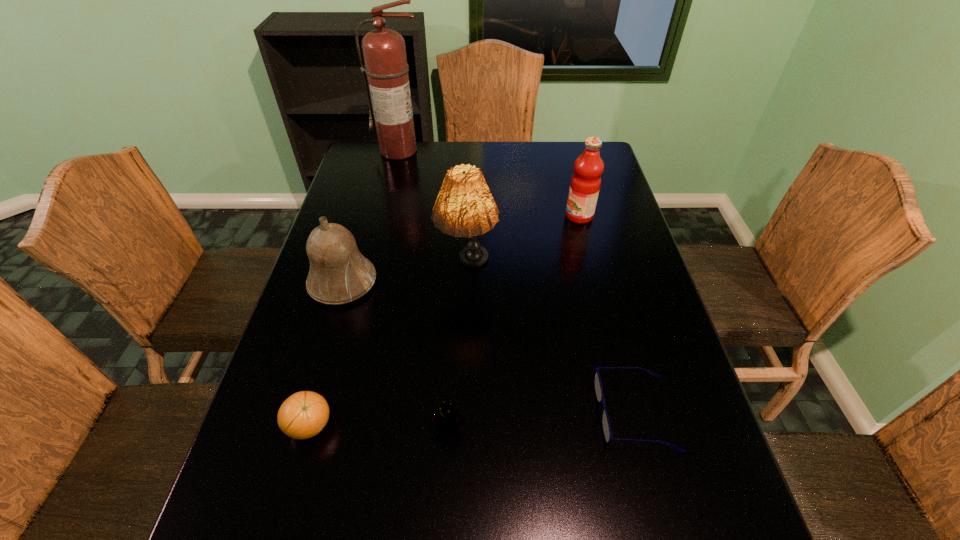
The image size is (960, 540). I want to click on vacant space that is in between the orange and the sixth shortest object, so click(389, 349).

Identify the location of vacant space that's between the lampshade and the fourth shortest object. (405, 277).

You are a GUI agent. You are given a task and a screenshot of the screen. Output one action in this format:
    pyautogui.click(x=<x>, y=<y>)
    Task: Click on the empty space that is in between the shortest object and the fire extinguisher
    This screenshot has width=960, height=540.
    Given the screenshot: What is the action you would take?
    pyautogui.click(x=517, y=282)

The image size is (960, 540). What are the coordinates of `empty location between the sixth nearest object and the second tallest object` in the screenshot? It's located at (523, 244).

This screenshot has height=540, width=960. Identify the location of vacant space that's between the shortest object and the bell. (489, 348).

This screenshot has height=540, width=960. I want to click on vacant space that's between the fruit juice and the lampshade, so click(523, 244).

Where is `free area in between the sixth nearest object and the farthest object`? Image resolution: width=960 pixels, height=540 pixels. free area in between the sixth nearest object and the farthest object is located at coordinates (490, 184).

This screenshot has width=960, height=540. I want to click on free space between the Lego and the orange, so click(x=379, y=428).

Select which object appears as the fourth closest to the lampshade. Please provide its 2D coordinates. Your answer should be formatted as a tuple, i.e. [(x, y)], where the tuple contains the x and y coordinates of a point satisfying the conditions above.

[(446, 417)]

Find the location of a particular element. The width and height of the screenshot is (960, 540). object that is the second closest one to the fourth shortest object is located at coordinates (304, 414).